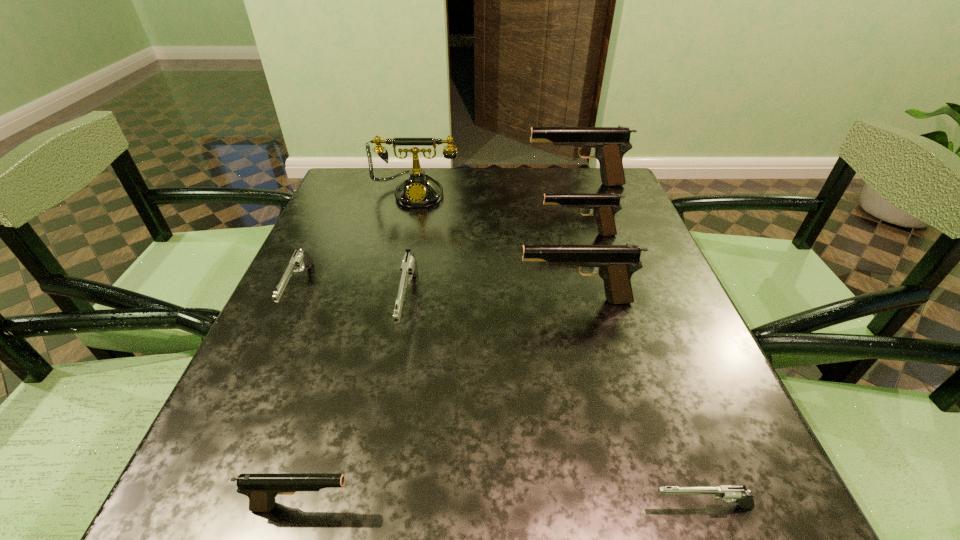
Where is `the nearest black pistol`? The width and height of the screenshot is (960, 540). the nearest black pistol is located at coordinates (261, 489).

You are a GUI agent. You are given a task and a screenshot of the screen. Output one action in this format:
    pyautogui.click(x=<x>, y=<y>)
    Task: Click on the second biggest silver pistol
    The height and width of the screenshot is (540, 960).
    Given the screenshot: What is the action you would take?
    pyautogui.click(x=300, y=258)

Image resolution: width=960 pixels, height=540 pixels. What are the coordinates of `the leftmost silver pistol` in the screenshot? It's located at (300, 258).

Find the location of a particular element. The height and width of the screenshot is (540, 960). the rightmost silver pistol is located at coordinates (728, 493).

This screenshot has width=960, height=540. Identify the location of the shortest object. (728, 493).

Find the location of `vacant area located 0.190m on the dial of the black telephone`. vacant area located 0.190m on the dial of the black telephone is located at coordinates [404, 254].

Identify the location of vacant space located 0.190m at the muzzle of the farthest pistol. The height and width of the screenshot is (540, 960). (458, 185).

Locate an element on the screen. Image resolution: width=960 pixels, height=540 pixels. vacant space situated at the muzzle of the farthest pistol is located at coordinates (509, 185).

At what (x,y) coordinates should I click in order to perform the action: click on vacant space located at the muzzle of the farthest pistol. Please return your answer as a coordinate pair (x, y). Looking at the image, I should click on (462, 185).

I want to click on free space located 0.100m at the muzzle of the second nearest black pistol, so click(468, 301).